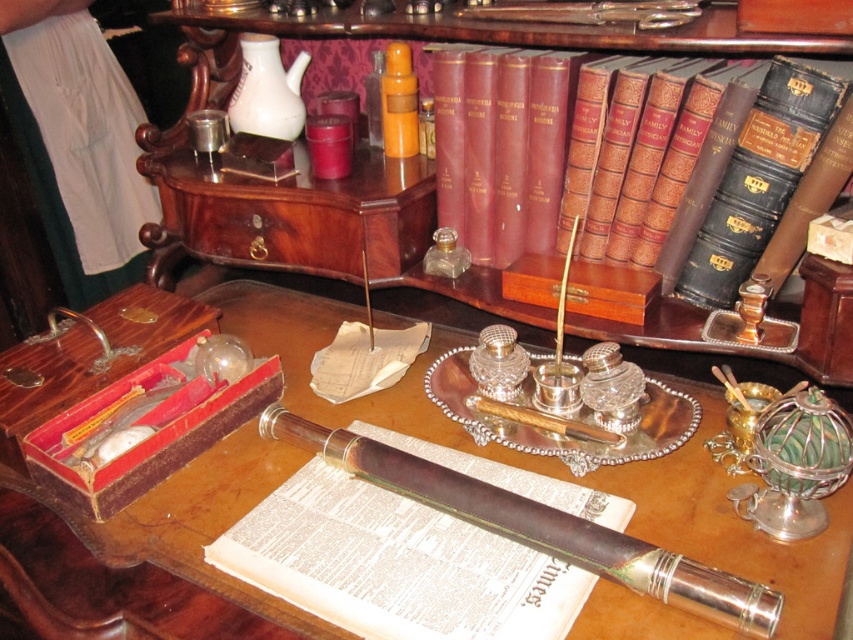
Looking at this image, does brown wooden table at center appear on the right side of leather-bound book at upper right?

In fact, brown wooden table at center is to the left of leather-bound book at upper right.

Between brown wooden table at center and leather-bound book at upper right, which one has more height?

With more height is leather-bound book at upper right.

Find the location of a particular element. The height and width of the screenshot is (640, 853). brown wooden table at center is located at coordinates (524, 452).

Is leather-bound book at upper right above polished silver pen at center?

Yes, leather-bound book at upper right is above polished silver pen at center.

In the scene shown: Does leather-bound book at upper right come in front of polished silver pen at center?

No, it is not.

Who is more forward, (566,170) or (770,636)?

Point (770,636)

The image size is (853, 640). I want to click on leather-bound book at upper right, so click(686, 150).

Locate an element on the screen. This screenshot has width=853, height=640. leather-bound books at upper center is located at coordinates (465, 35).

Can you confirm if leather-bound books at upper center is positioned above polished silver pen at center?

Yes, leather-bound books at upper center is above polished silver pen at center.

Is point (506, 310) positioned in front of point (608, 531)?

That is False.

What are the coordinates of `leather-bound books at upper center` in the screenshot? It's located at (465, 35).